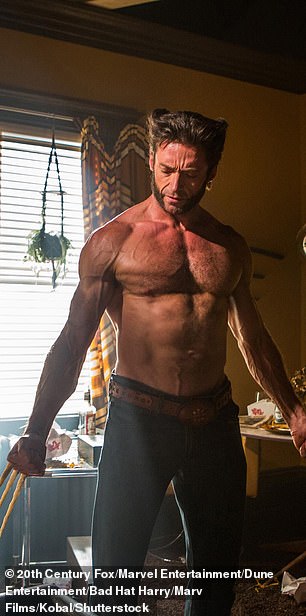
I want to click on plant, so click(48, 256).